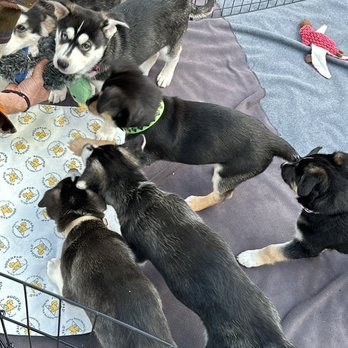
Where is `gray toy`? Image resolution: width=348 pixels, height=348 pixels. gray toy is located at coordinates (54, 81).